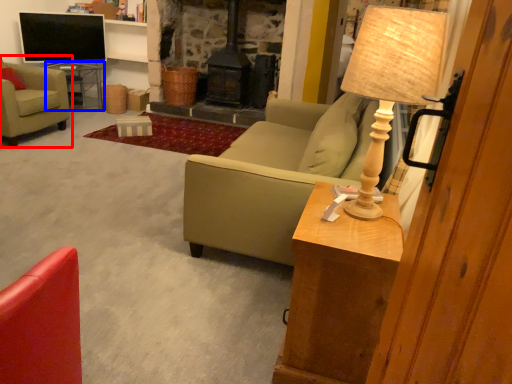
Question: Which object is further to the camera taking this photo, chair (highlighted by a red box) or table (highlighted by a blue box)?

Choices:
 (A) chair
 (B) table

Answer: (B)